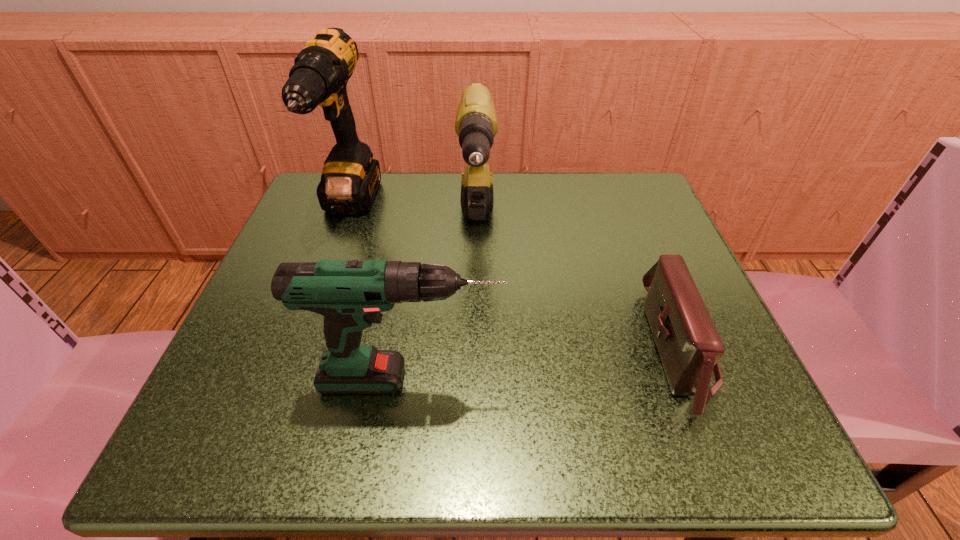
This screenshot has width=960, height=540. What are the coordinates of `vacant space that is in between the nearest drill and the rightmost object` in the screenshot? It's located at (544, 364).

Locate an element on the screen. The image size is (960, 540). vacant region between the shortest object and the nearest drill is located at coordinates (544, 364).

At what (x,y) coordinates should I click in order to perform the action: click on free space that is in between the shortest object and the tallest object. Please return your answer as a coordinate pair (x, y). Image resolution: width=960 pixels, height=540 pixels. Looking at the image, I should click on (514, 279).

Identify the location of vacant area that lies between the tallest object and the shortest object. The image size is (960, 540). (514, 279).

Identify which object is located as the second nearest to the tallest object. Please provide its 2D coordinates. Your answer should be formatted as a tuple, i.e. [(x, y)], where the tuple contains the x and y coordinates of a point satisfying the conditions above.

[(351, 294)]

Identify the location of object that ranks as the second closest to the nearest drill. The image size is (960, 540). (689, 346).

Identify the location of drill object that ranks as the third closest to the shortest object. The width and height of the screenshot is (960, 540). (350, 179).

Where is `drill identified as the closest to the tallest drill`? drill identified as the closest to the tallest drill is located at coordinates (476, 125).